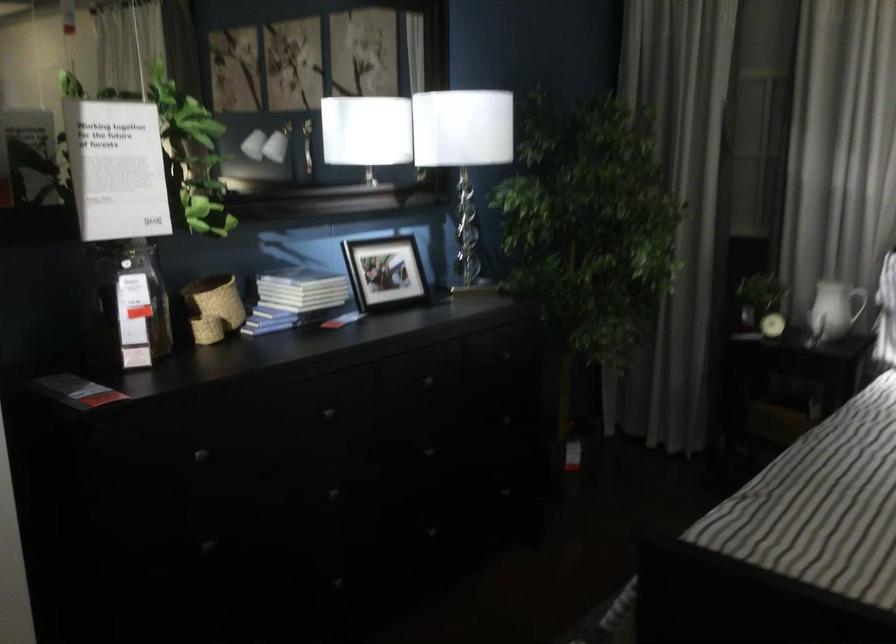
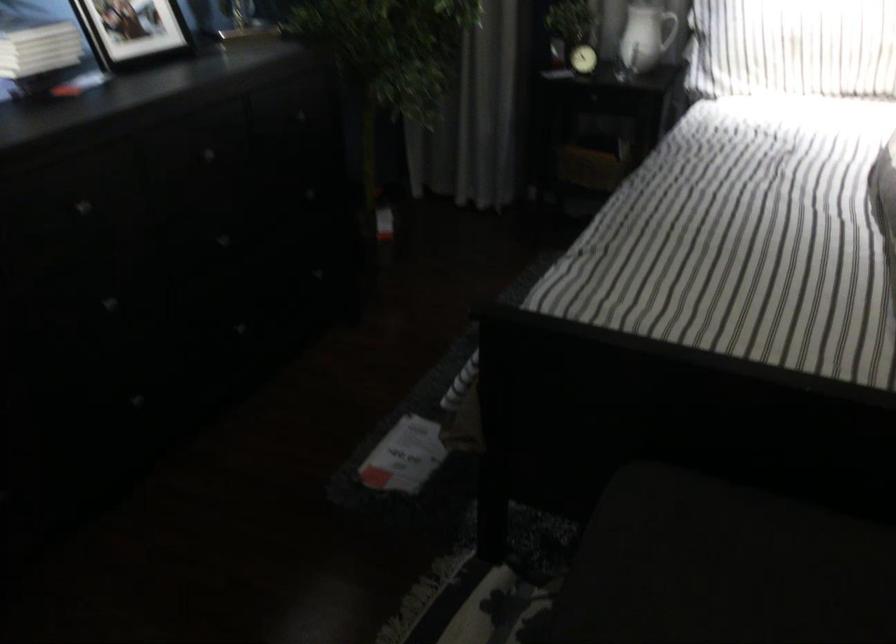
Question: The images are taken continuously from a first-person perspective. In which direction are you moving?

Choices:
 (A) Left
 (B) Right
 (C) Forward
 (D) Backward

Answer: (C)